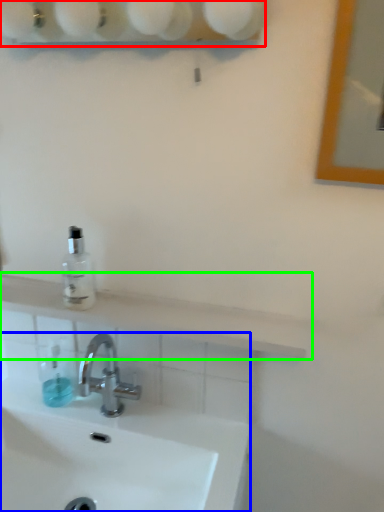
Question: Based on their relative distances, which object is nearer to shelf (highlighted by a red box)? Choose from sink (highlighted by a blue box) and counter top (highlighted by a green box).

Choices:
 (A) sink
 (B) counter top

Answer: (B)